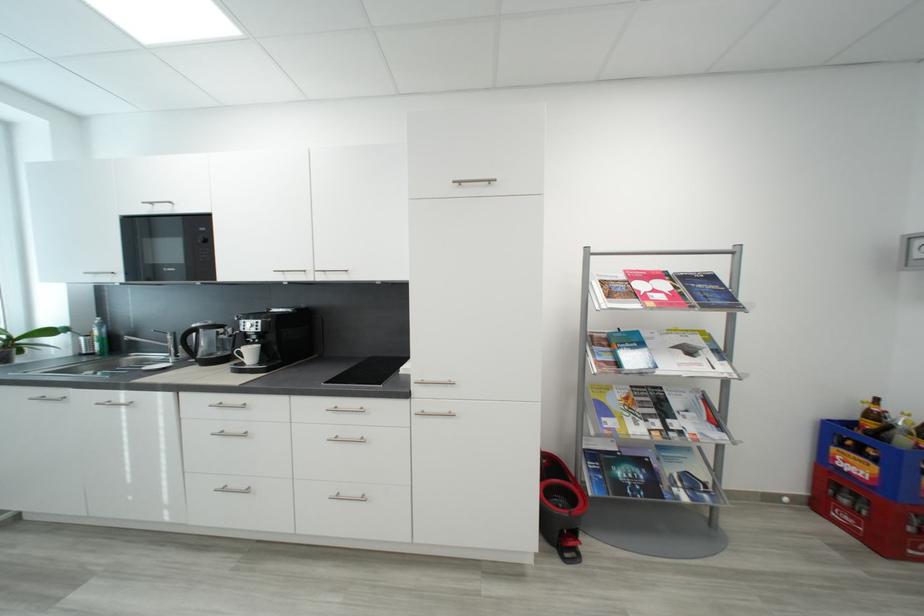
Find where to lift the black kettle handle. Please return your answer as a coordinate pair (x, y).

(228, 336)